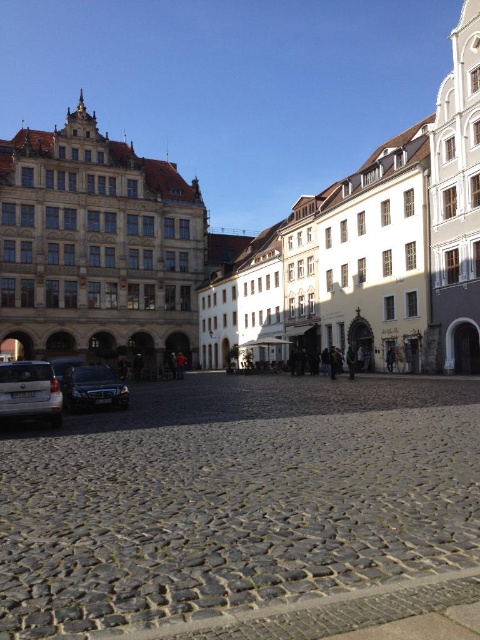
Is gray cobblestone at center taller than silver metallic van at lower left?

No, gray cobblestone at center is not taller than silver metallic van at lower left.

Does point (54, 524) come closer to viewer compared to point (3, 408)?

Yes, point (54, 524) is in front of point (3, 408).

The height and width of the screenshot is (640, 480). Identify the location of gray cobblestone at center. (243, 509).

Who is higher up, silver metallic van at lower left or shiny silver car at lower left?

silver metallic van at lower left is higher up.

Measure the distance between silver metallic van at lower left and shiny silver car at lower left.

silver metallic van at lower left is 6.13 meters away from shiny silver car at lower left.

Is point (26, 388) farther from camera compared to point (103, 394)?

No, (26, 388) is in front of (103, 394).

Where is `silver metallic van at lower left`? silver metallic van at lower left is located at coordinates (29, 392).

How distant is gray cobblestone at center from shiny silver car at lower left?

gray cobblestone at center is 15.56 meters away from shiny silver car at lower left.

Describe the element at coordinates (243, 509) in the screenshot. This screenshot has width=480, height=640. I see `gray cobblestone at center` at that location.

The image size is (480, 640). I want to click on gray cobblestone at center, so point(243,509).